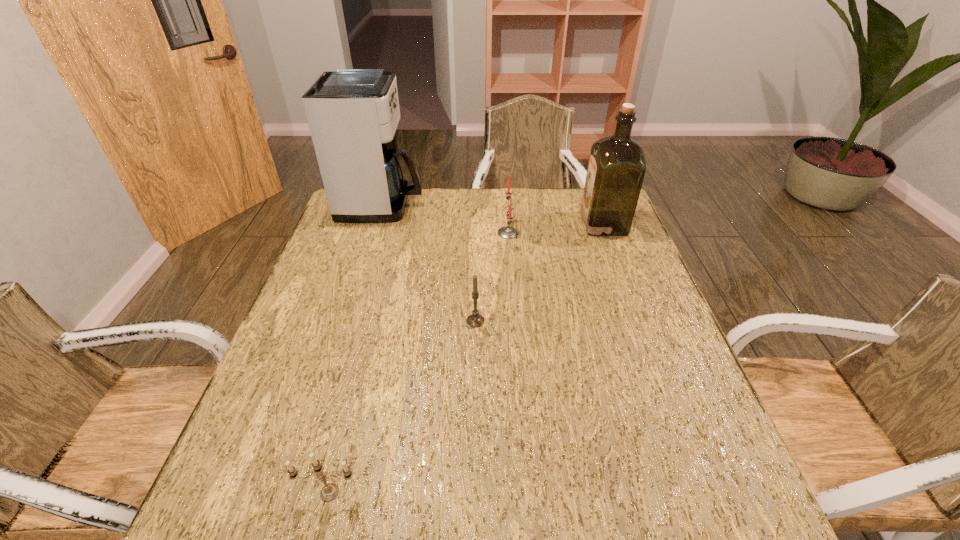
You are a GUI agent. You are given a task and a screenshot of the screen. Output one action in this format:
    pyautogui.click(x=<x>, y=<y>)
    Task: Click on the free space at the near left corner
    The height and width of the screenshot is (540, 960).
    Given the screenshot: What is the action you would take?
    pyautogui.click(x=266, y=521)

The image size is (960, 540). In the image, there is a desktop. What are the coordinates of `blank space at the near right corner` in the screenshot? It's located at (694, 513).

Find the location of `vacant space in between the rightmost object and the coffee maker`. vacant space in between the rightmost object and the coffee maker is located at coordinates (492, 214).

The width and height of the screenshot is (960, 540). In order to click on free space between the coffee maker and the liquor in this screenshot , I will do `click(492, 214)`.

I want to click on blank region between the coffee maker and the nearest object, so click(356, 349).

Find the location of a particular element. empty location between the second nearest candle and the leftmost candle is located at coordinates coord(402,407).

The width and height of the screenshot is (960, 540). I want to click on vacant point located between the nearest object and the coffee maker, so click(x=356, y=349).

I want to click on vacant area that lies between the fourth farthest object and the rightmost object, so click(x=540, y=272).

You are a GUI agent. You are given a task and a screenshot of the screen. Output one action in this format:
    pyautogui.click(x=<x>, y=<y>)
    Task: Click on the vacant space that's between the coffee maker and the second candle from left to right
    Image resolution: width=960 pixels, height=540 pixels.
    Given the screenshot: What is the action you would take?
    pyautogui.click(x=429, y=263)

At what (x,y) coordinates should I click in order to perform the action: click on empty space between the rightmost object and the rightmost candle. Please return your answer as a coordinate pair (x, y). Looking at the image, I should click on (556, 228).